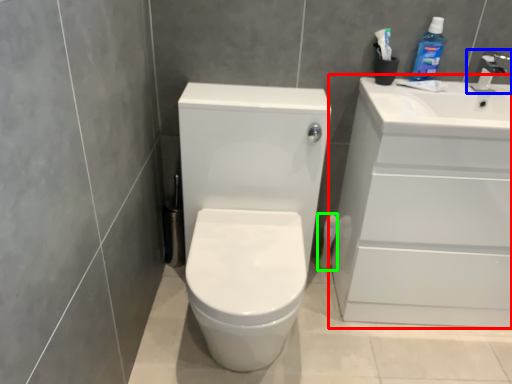
Question: Which object is the farthest from bathroom cabinet (highlighted by a red box)? Choose among these: tap (highlighted by a blue box) or toilet paper (highlighted by a green box).

Choices:
 (A) tap
 (B) toilet paper

Answer: (B)